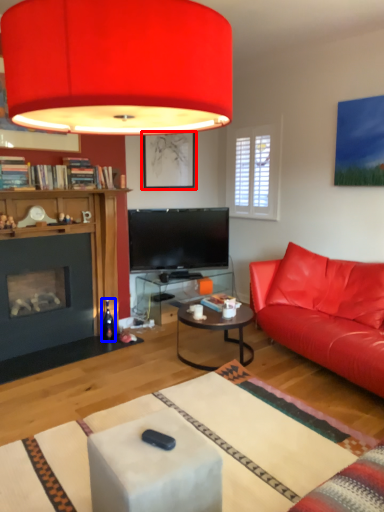
Question: Which of the following is the farthest to the observer, picture frame (highlighted by a red box) or wine bottle (highlighted by a blue box)?

Choices:
 (A) picture frame
 (B) wine bottle

Answer: (A)